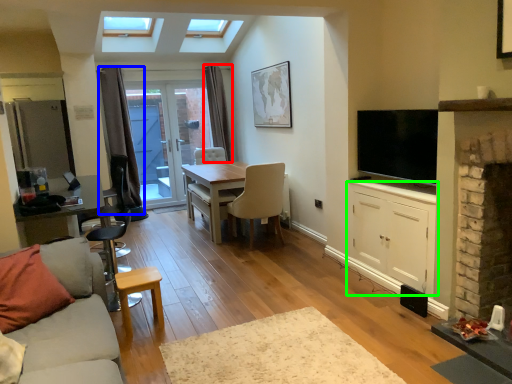
Question: Which is nearer to the curtain (highlighted by a red box)? curtain (highlighted by a blue box) or cabinetry (highlighted by a green box).

Choices:
 (A) curtain
 (B) cabinetry

Answer: (A)